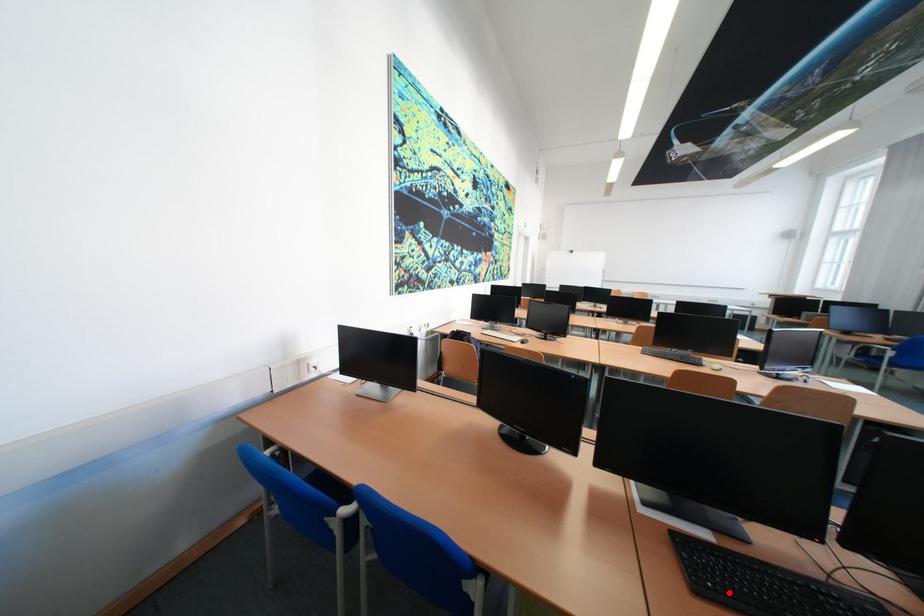
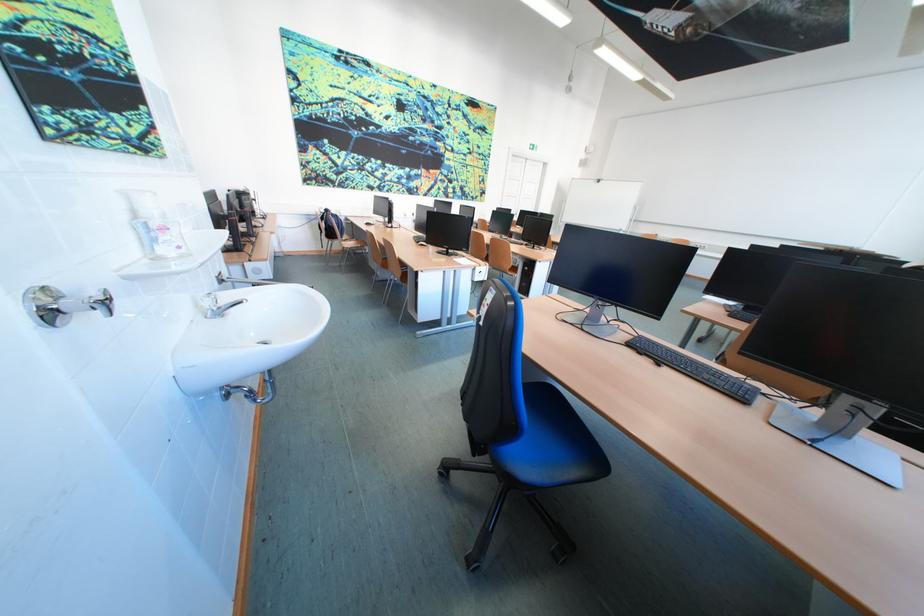
Question: I am providing you with two images of the same scene from different viewpoints. A red point is marked on the first image. At the location where the point appears in image 1, is it still visible in image 2?

Choices:
 (A) Yes
 (B) No

Answer: (B)